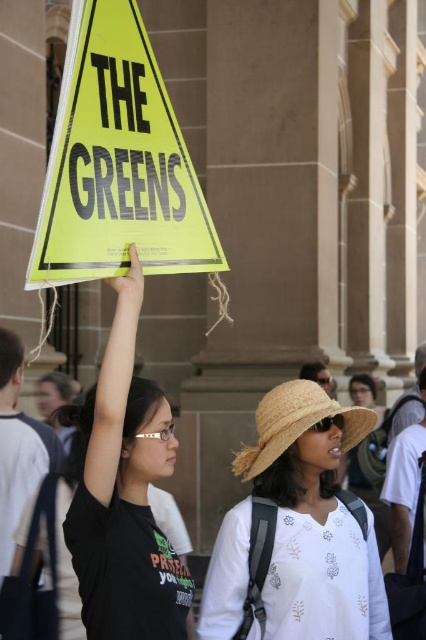
Question: Is yellow paper sign at upper left smaller than strawmaterial/texturehat at center?

Choices:
 (A) no
 (B) yes

Answer: (B)

Question: Is black matte t-shirt at upper left behind strawmaterial/texturehat at center?

Choices:
 (A) yes
 (B) no

Answer: (B)

Question: Does yellow paper sign at upper left have a lesser width compared to strawmaterial/texturehat at center?

Choices:
 (A) no
 (B) yes

Answer: (B)

Question: Which object appears farthest from the camera in this image?

Choices:
 (A) black matte t-shirt at upper left
 (B) strawmaterial/texturehat at center

Answer: (B)

Question: Which point is farther from the camera taking this photo?

Choices:
 (A) (146, 576)
 (B) (331, 477)
 (C) (293, 388)
 (D) (164, 170)

Answer: (B)

Question: Which of the following is the farthest from the observer?

Choices:
 (A) (175, 449)
 (B) (245, 468)
 (C) (305, 499)
 (D) (89, 273)

Answer: (A)